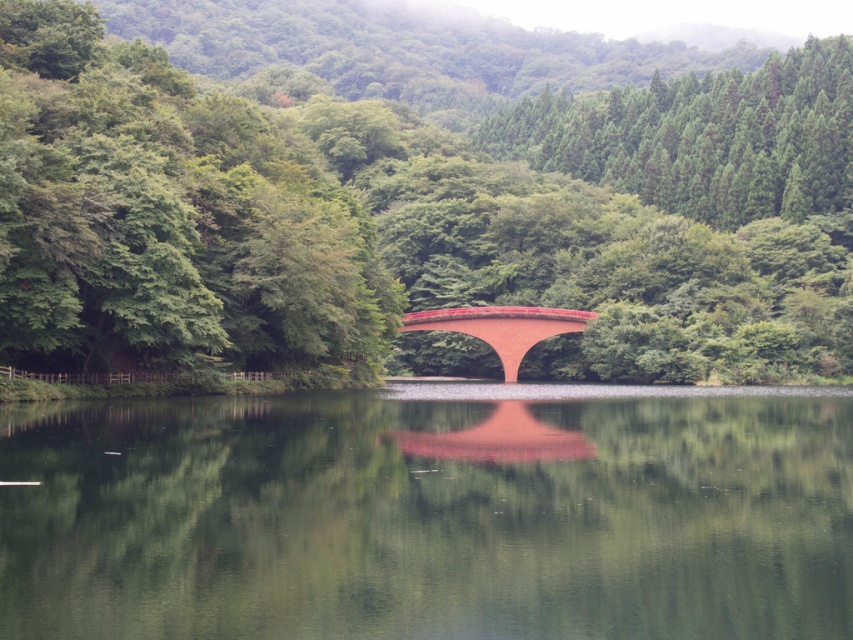
You are a painter standing at the edge of the lake and want to capture the scene. Which object, the matte red bridge at center or the green smooth water at center, would you need to paint first if you follow the rule of painting objects closer to you first?

The matte red bridge at center is larger in size than the green smooth water at center, so you should paint the matte red bridge at center first because it is closer to you.

You are standing at the edge of the lake and want to take a photo of the green smooth water at center. Where should you aim your camera to capture it?

The green smooth water at center is located at point 0.809 on the horizontal axis and 0.502 on the vertical axis, so aim your camera towards those coordinates to capture it.

You are standing at the edge of the lake and want to cross to the other side. The only path available is the matte red bridge at center. If you start walking towards the bridge from your current position, which direction should you head in?

You should head towards the center of the lake since the matte red bridge at center is located at point coordinates (413, 211), which is the central area.